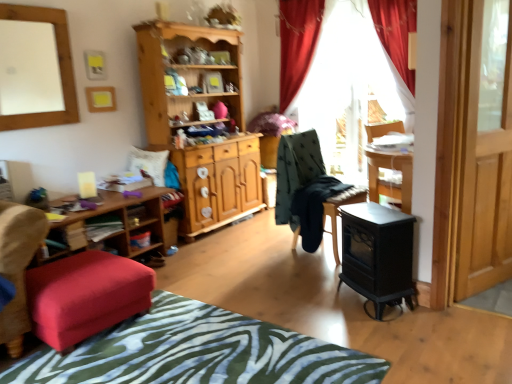
The height and width of the screenshot is (384, 512). What do you see at coordinates (59, 64) in the screenshot?
I see `white matte mirror at upper left` at bounding box center [59, 64].

You are a GUI agent. You are given a task and a screenshot of the screen. Output one action in this format:
    pyautogui.click(x=<x>, y=<y>)
    Task: Click on the wooden cabinet at center
    
    Given the screenshot: What is the action you would take?
    pyautogui.click(x=201, y=121)

The height and width of the screenshot is (384, 512). Describe the element at coordinates (113, 221) in the screenshot. I see `wooden shelf at lower left` at that location.

This screenshot has height=384, width=512. In order to click on red velvet curtain at upper center in this screenshot , I will do `click(297, 44)`.

The image size is (512, 384). What are the coordinates of `screen door above the dark green fabric chair at center (from the image's perspective)` in the screenshot? It's located at (485, 153).

Is transparent glass door at right oriented towards dark green fabric chair at center?

No, transparent glass door at right is not aimed at dark green fabric chair at center.

Considering the positions of point (493, 205) and point (314, 165), is point (493, 205) closer or farther from the camera than point (314, 165)?

Clearly, point (493, 205) is closer to the camera than point (314, 165).

Between point (67, 69) and point (81, 301), which one is positioned behind?

Point (67, 69)

How much distance is there between white matte mirror at upper left and velvet red ottoman at lower left?

A distance of 4.63 feet exists between white matte mirror at upper left and velvet red ottoman at lower left.

Which is in front, white matte mirror at upper left or velvet red ottoman at lower left?

velvet red ottoman at lower left is in front.

Where is `mirror above the velvet red ottoman at lower left (from a real-world perspective)`? This screenshot has width=512, height=384. mirror above the velvet red ottoman at lower left (from a real-world perspective) is located at coordinates (59, 64).

Is point (354, 270) behind point (152, 233)?

No.

Where is `shelf behind the black matte wood stove at lower right`? This screenshot has width=512, height=384. shelf behind the black matte wood stove at lower right is located at coordinates (146, 237).

From a real-world perspective, who is located higher, black matte wood stove at lower right or wooden shelf at lower left?

black matte wood stove at lower right.

In the scene shown: Which of these two, black matte wood stove at lower right or wooden shelf at lower left, is bigger?

Bigger between the two is black matte wood stove at lower right.

Between black matte wood stove at lower right and red velvet curtain at upper center, which one has larger width?

With larger width is black matte wood stove at lower right.

Which object is positioned more to the right, black matte wood stove at lower right or red velvet curtain at upper center?

Positioned to the right is red velvet curtain at upper center.

Who is shorter, black matte wood stove at lower right or red velvet curtain at upper center?

Standing shorter between the two is black matte wood stove at lower right.

How far apart are black matte wood stove at lower right and red velvet curtain at upper center?

black matte wood stove at lower right and red velvet curtain at upper center are 2.64 meters apart.

Is white matte mirror at upper left far from dark green fabric chair at center?

white matte mirror at upper left is positioned a significant distance from dark green fabric chair at center.

Would you say white matte mirror at upper left is to the left or to the right of dark green fabric chair at center in the picture?

white matte mirror at upper left is to the left of dark green fabric chair at center.

How many degrees apart are the facing directions of white matte mirror at upper left and dark green fabric chair at center?

The angle between the facing direction of white matte mirror at upper left and the facing direction of dark green fabric chair at center is 8.79 degrees.

Considering the sizes of white matte mirror at upper left and dark green fabric chair at center in the image, is white matte mirror at upper left wider or thinner than dark green fabric chair at center?

white matte mirror at upper left is thinner than dark green fabric chair at center.

How distant is velvet red ottoman at lower left from red velvet curtain at upper center?

velvet red ottoman at lower left is 3.09 meters from red velvet curtain at upper center.

Is point (124, 274) less distant than point (290, 101)?

Yes, point (124, 274) is closer to viewer.

Does velvet red ottoman at lower left lie behind red velvet curtain at upper center?

No, velvet red ottoman at lower left is in front of red velvet curtain at upper center.

Is velvet red ottoman at lower left situated inside red velvet curtain at upper center or outside?

velvet red ottoman at lower left lies outside red velvet curtain at upper center.

Which of these two, wooden cabinet at center or white matte mirror at upper left, is wider?

wooden cabinet at center is wider.

Is wooden cabinet at center located outside white matte mirror at upper left?

Indeed, wooden cabinet at center is completely outside white matte mirror at upper left.

From a real-world perspective, is wooden cabinet at center positioned over white matte mirror at upper left based on gravity?

No, from a real-world perspective, wooden cabinet at center is not over white matte mirror at upper left

Is wooden cabinet at center touching white matte mirror at upper left?

They are not placed beside each other.

You are a GUI agent. You are given a task and a screenshot of the screen. Output one action in this format:
    pyautogui.click(x=<x>, y=<y>)
    Task: Click on the screen door lying above the dark green fabric chair at center (from the image's perspective)
    Image resolution: width=512 pixels, height=384 pixels.
    Given the screenshot: What is the action you would take?
    pyautogui.click(x=485, y=153)

You are a GUI agent. You are given a task and a screenshot of the screen. Output one action in this format:
    pyautogui.click(x=<x>, y=<y>)
    Task: Click on the mirror above the velvet red ottoman at lower left (from a real-world perspective)
    Image resolution: width=512 pixels, height=384 pixels.
    Given the screenshot: What is the action you would take?
    pyautogui.click(x=59, y=64)

From the image, which object appears to be farther from black matte wood stove at lower right, dark green fabric chair at center or white matte mirror at upper left?

white matte mirror at upper left is further to black matte wood stove at lower right.

When comparing their distances from transparent glass door at right, does white matte mirror at upper left or wooden shelf at lower left seem closer?

wooden shelf at lower left lies closer to transparent glass door at right than the other object.

Considering their positions, is red velvet curtain at upper center positioned closer to dark green fabric chair at center than zebra print fabric at lower center?

zebra print fabric at lower center is closer to dark green fabric chair at center.

From the image, which object appears to be nearer to black matte wood stove at lower right, white matte mirror at upper left or wooden cabinet at center?

Based on the image, wooden cabinet at center appears to be nearer to black matte wood stove at lower right.

Considering their positions, is wooden shelf at lower left positioned further to white matte mirror at upper left than velvet red ottoman at lower left?

velvet red ottoman at lower left is positioned further to the anchor white matte mirror at upper left.

When comparing their distances from black matte wood stove at lower right, does wooden shelf at lower left or red velvet curtain at upper center seem closer?

The object closer to black matte wood stove at lower right is wooden shelf at lower left.

Looking at the image, which one is located further to wooden shelf at lower left, zebra print fabric at lower center or velvet red ottoman at lower left?

zebra print fabric at lower center is positioned further to the anchor wooden shelf at lower left.

Based on their spatial positions, is wooden shelf at lower left or zebra print fabric at lower center closer to black matte wood stove at lower right?

zebra print fabric at lower center is closer to black matte wood stove at lower right.

Where is `cabinetry between velvet red ottoman at lower left and red velvet curtain at upper center in the horizontal direction`? This screenshot has height=384, width=512. cabinetry between velvet red ottoman at lower left and red velvet curtain at upper center in the horizontal direction is located at coordinates (201, 121).

Image resolution: width=512 pixels, height=384 pixels. In order to click on cabinetry between wooden shelf at lower left and transparent glass door at right in the horizontal direction in this screenshot , I will do `click(201, 121)`.

At what (x,y) coordinates should I click in order to perform the action: click on cabinetry between wooden shelf at lower left and red velvet curtain at upper center. Please return your answer as a coordinate pair (x, y). Looking at the image, I should click on (201, 121).

In order to click on cabinetry situated between wooden shelf at lower left and dark green fabric chair at center from left to right in this screenshot , I will do `click(201, 121)`.